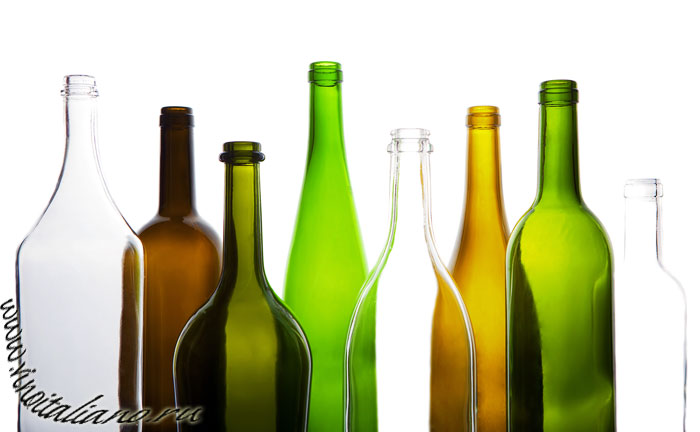
Where is `bottles`? This screenshot has height=432, width=700. bottles is located at coordinates (77, 151), (168, 162), (245, 179), (326, 188), (410, 205), (482, 219), (547, 243), (628, 272).